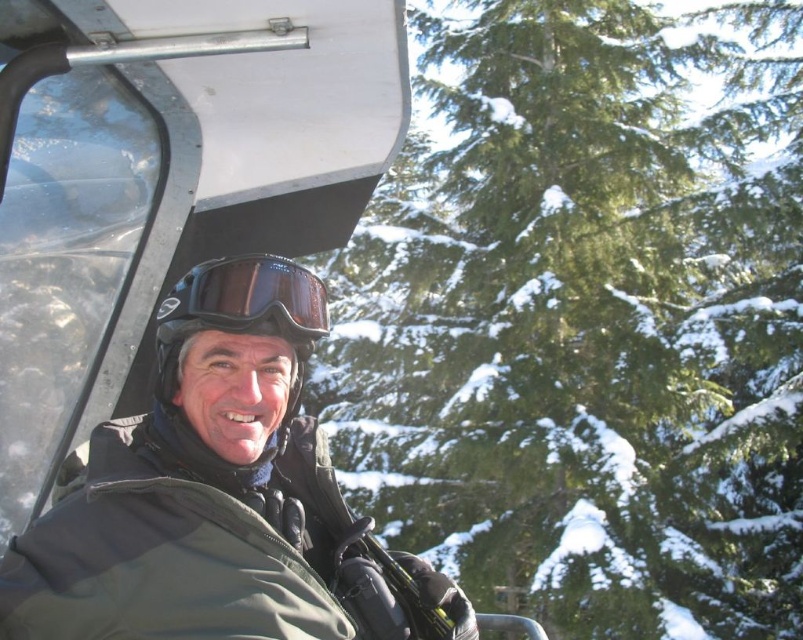
You are planning to take a photo of the green textured pine at upper center and the matte black goggles at center. Which object should you focus on first if you want to capture both in one shot without moving the camera?

The green textured pine at upper center should be focused on first because it has a larger size compared to the matte black goggles at center, making it more prominent in the frame.

You are standing in the ski lift cabin and want to reach the two points marked on the cabin wall. Which point, point (x=454, y=404) or point (x=173, y=308), is closer to you?

Point (x=454, y=404) is further to the viewer than point (x=173, y=308), so the closer point is point (x=173, y=308).

You are a photographer planning to take a photo of the person in the ski lift cabin. The point at coordinates point (587, 317) is part of the background. What object is located at that point?

The point (587, 317) indicates green textured pine at upper center.